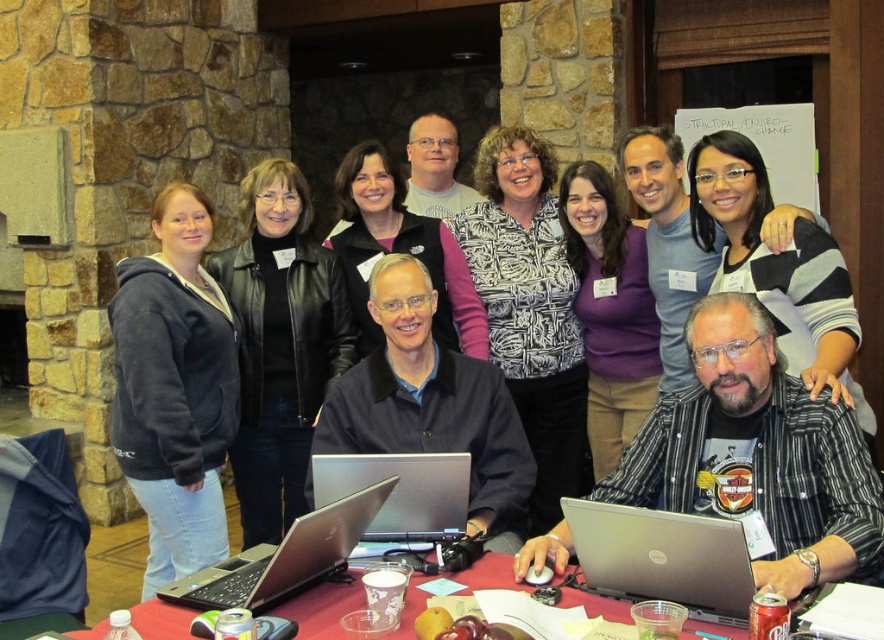
Question: Which object appears farthest from the camera in this image?

Choices:
 (A) dark gray fleece jacket at left
 (B) satin silver laptop at center
 (C) silver metallic laptop at center
 (D) matte black jacket at center

Answer: (D)

Question: Estimate the real-world distances between objects in this image. Which object is farther from the matte black jacket at center?

Choices:
 (A) silver metallic laptop at center
 (B) silver metallic laptop at lower center

Answer: (B)

Question: Considering the relative positions of silver metallic laptop at center and red plastic table at center in the image provided, where is silver metallic laptop at center located with respect to red plastic table at center?

Choices:
 (A) below
 (B) above

Answer: (B)

Question: Which object is farther from the camera taking this photo?

Choices:
 (A) black leather jacket at upper left
 (B) silver metallic laptop at center
 (C) silver metallic laptop at lower center

Answer: (A)

Question: Is dark gray fleece jacket at left to the right of black leather jacket at upper left from the viewer's perspective?

Choices:
 (A) no
 (B) yes

Answer: (A)

Question: Does dark gray fleece jacket at left appear over matte black jacket at center?

Choices:
 (A) yes
 (B) no

Answer: (B)